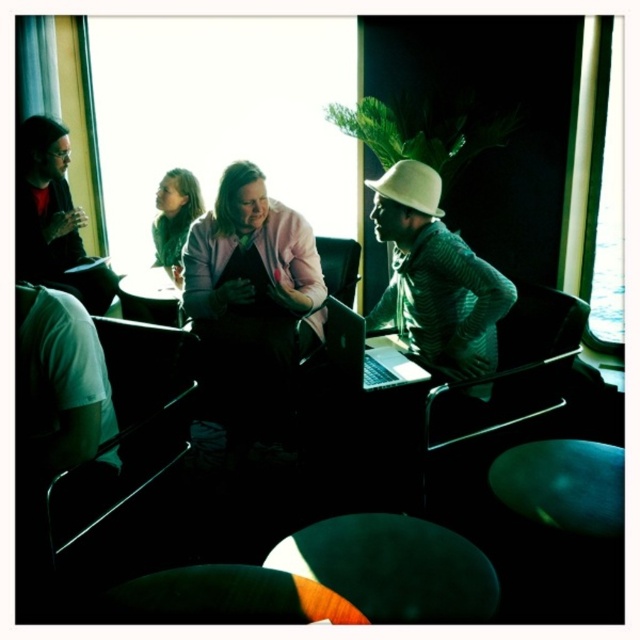
Does matte pink sweater at center have a greater height compared to orange fabric table at lower center?

Indeed, matte pink sweater at center has a greater height compared to orange fabric table at lower center.

Can you confirm if matte pink sweater at center is positioned below orange fabric table at lower center?

No.

You are a GUI agent. You are given a task and a screenshot of the screen. Output one action in this format:
    pyautogui.click(x=<x>, y=<y>)
    Task: Click on the matte pink sweater at center
    
    Given the screenshot: What is the action you would take?
    pyautogui.click(x=250, y=305)

Locate an element on the screen. This screenshot has height=640, width=640. matte pink sweater at center is located at coordinates (250, 305).

Does matte black jacket at left appear over green knit sweater at center?

Indeed, matte black jacket at left is positioned over green knit sweater at center.

Locate an element on the screen. matte black jacket at left is located at coordinates (52, 218).

Is point (112, 278) behind point (166, 218)?

Yes, point (112, 278) is farther from viewer.

The image size is (640, 640). I want to click on matte black jacket at left, so click(52, 218).

Can you confirm if metallic silver chair at left is taller than green knit sweater at center?

Yes, metallic silver chair at left is taller than green knit sweater at center.

Is metallic silver chair at left further to camera compared to green knit sweater at center?

No, metallic silver chair at left is in front of green knit sweater at center.

Where is `metallic silver chair at left`? The image size is (640, 640). metallic silver chair at left is located at coordinates (128, 433).